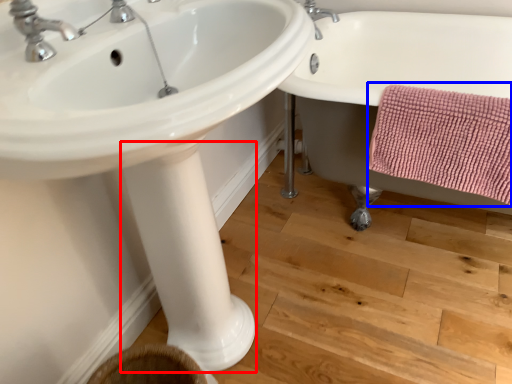
Question: Which point is further to the camera, pillar (highlighted by a red box) or bath towel (highlighted by a blue box)?

Choices:
 (A) pillar
 (B) bath towel

Answer: (A)